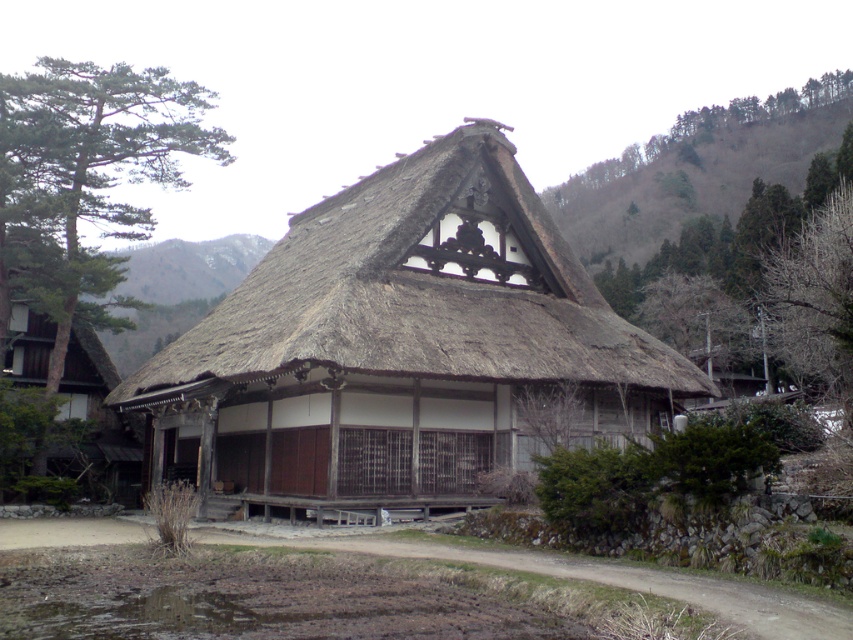
You are planning to install a garden path between the brown thatch at center and the green leafy tree at left. The path must be straight and 10 feet wide. Can you fit the path between them without overlapping either structure?

The distance between the brown thatch at center and the green leafy tree at left is 30.58 feet. Since the path is 10 feet wide, the minimum required space is 10 feet. The existing distance of 30.58 feet is more than sufficient to accommodate the path without overlapping either structure.

Based on the photo, you are standing in front of the traditional Japanese house and want to know the position of the brown thatch at center relative to the green leafy tree at left. Which object is positioned lower in the image?

The brown thatch at center is located below the green leafy tree at left, so it is positioned lower in the image.